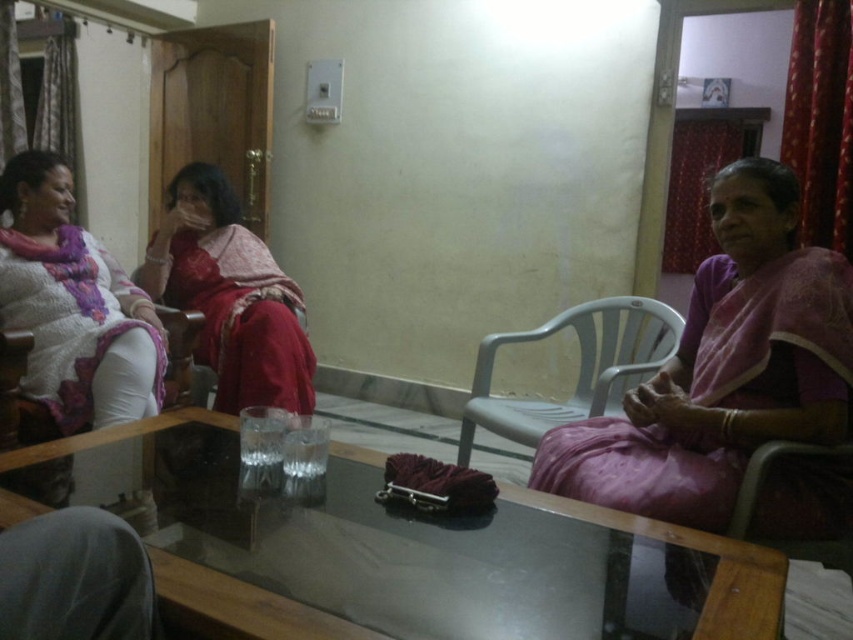
Does matte pink saree at center appear on the left side of plastic chair at right?

Indeed, matte pink saree at center is positioned on the left side of plastic chair at right.

Which of these two, matte pink saree at center or plastic chair at right, stands taller?

matte pink saree at center

Where is `matte pink saree at center`? matte pink saree at center is located at coordinates (239, 316).

Which is more to the right, transparent glass table at center or purple silk saree at right?

purple silk saree at right is more to the right.

Does transparent glass table at center have a smaller size compared to purple silk saree at right?

No, transparent glass table at center is not smaller than purple silk saree at right.

The height and width of the screenshot is (640, 853). I want to click on transparent glass table at center, so click(392, 548).

Find the location of a particular element. The height and width of the screenshot is (640, 853). transparent glass table at center is located at coordinates (392, 548).

Does matte white pants at left appear over wooden chair at center?

Yes, matte white pants at left is above wooden chair at center.

Locate an element on the screen. This screenshot has height=640, width=853. matte white pants at left is located at coordinates (73, 307).